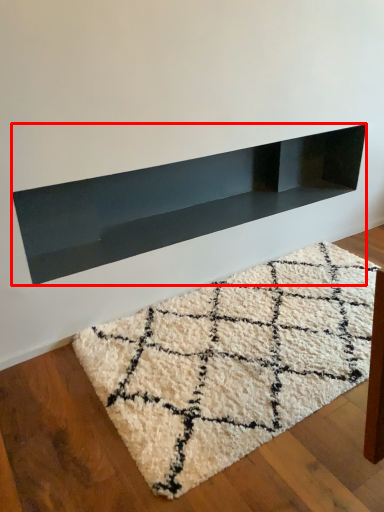
Question: In this image, where is shelf (annotated by the red box) located relative to mat?

Choices:
 (A) left
 (B) right

Answer: (A)